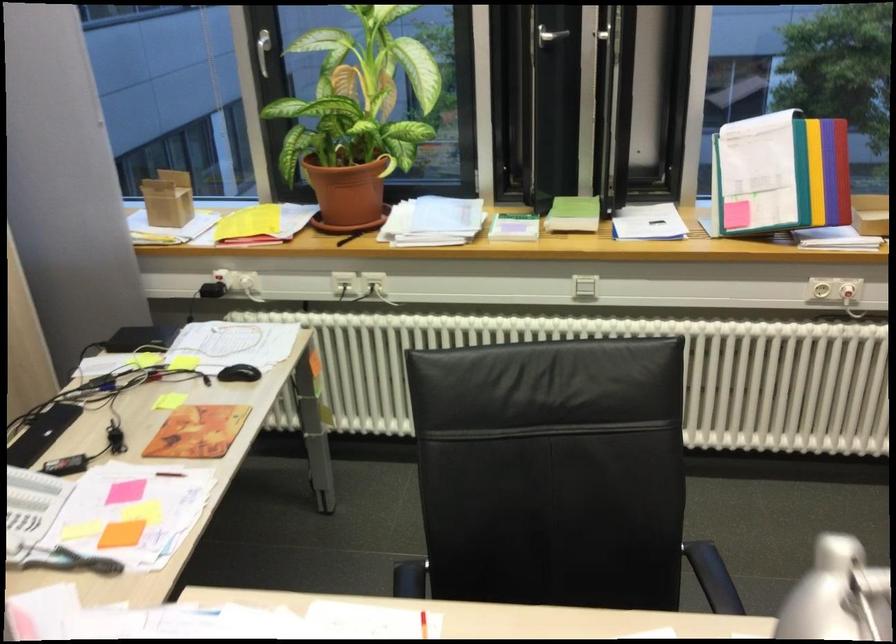
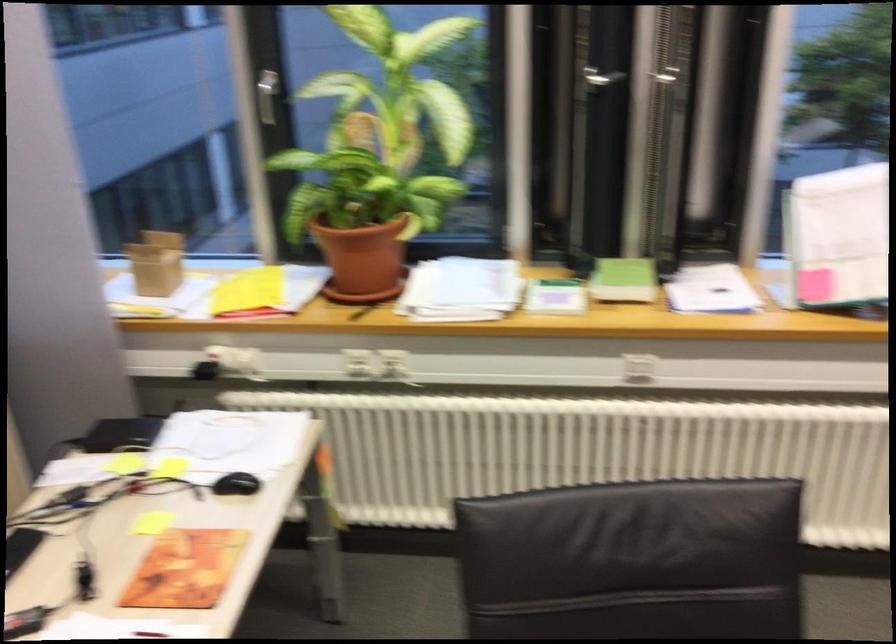
The point at (348, 194) is marked in the first image. Where is the corresponding point in the second image?

(363, 257)